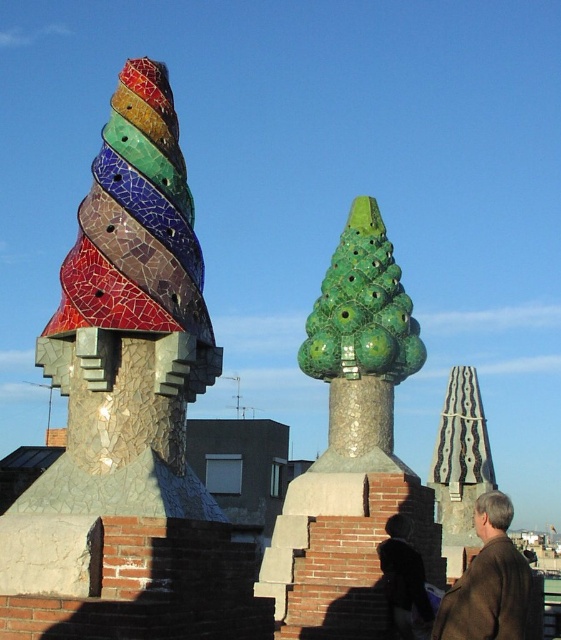
Does cracked mosaic chimney at left have a smaller size compared to brown woolen jacket at lower right?

Yes, cracked mosaic chimney at left is smaller than brown woolen jacket at lower right.

Does cracked mosaic chimney at left have a greater height compared to brown woolen jacket at lower right?

Yes.

This screenshot has height=640, width=561. In order to click on cracked mosaic chimney at left in this screenshot , I will do `click(131, 323)`.

Is green glossy cone at center shorter than brown woolen jacket at lower right?

In fact, green glossy cone at center may be taller than brown woolen jacket at lower right.

Can you confirm if green glossy cone at center is taller than brown woolen jacket at lower right?

Indeed, green glossy cone at center has a greater height compared to brown woolen jacket at lower right.

This screenshot has height=640, width=561. I want to click on green glossy cone at center, so [351, 449].

Measure the distance between point (149, 90) and camera.

A distance of 163.32 feet exists between point (149, 90) and camera.

Does cracked mosaic chimney at left appear under green glossy cone at center?

Incorrect, cracked mosaic chimney at left is not positioned below green glossy cone at center.

Does point (195, 289) come behind point (421, 362)?

No, (195, 289) is closer to viewer.

This screenshot has width=561, height=640. What are the coordinates of `cracked mosaic chimney at left` in the screenshot? It's located at (131, 323).